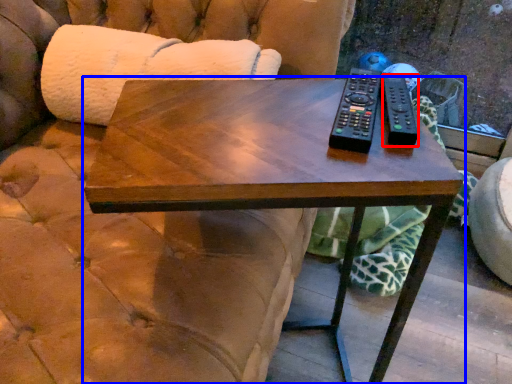
Question: Among these objects, which one is nearest to the camera, remote (highlighted by a red box) or coffee table (highlighted by a blue box)?

Choices:
 (A) remote
 (B) coffee table

Answer: (B)